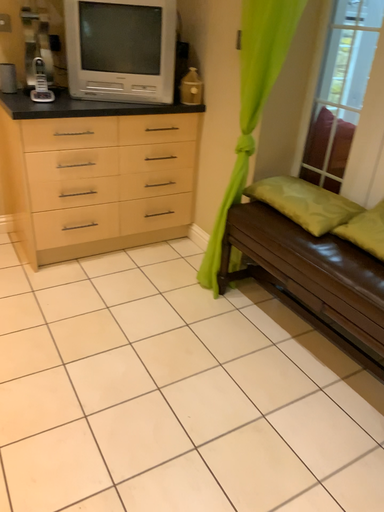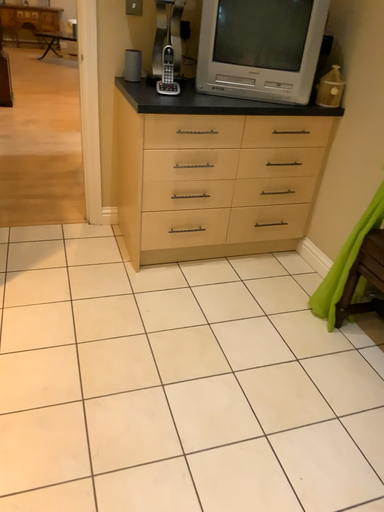
Question: How did the camera likely rotate when shooting the video?

Choices:
 (A) rotated right
 (B) rotated left

Answer: (B)